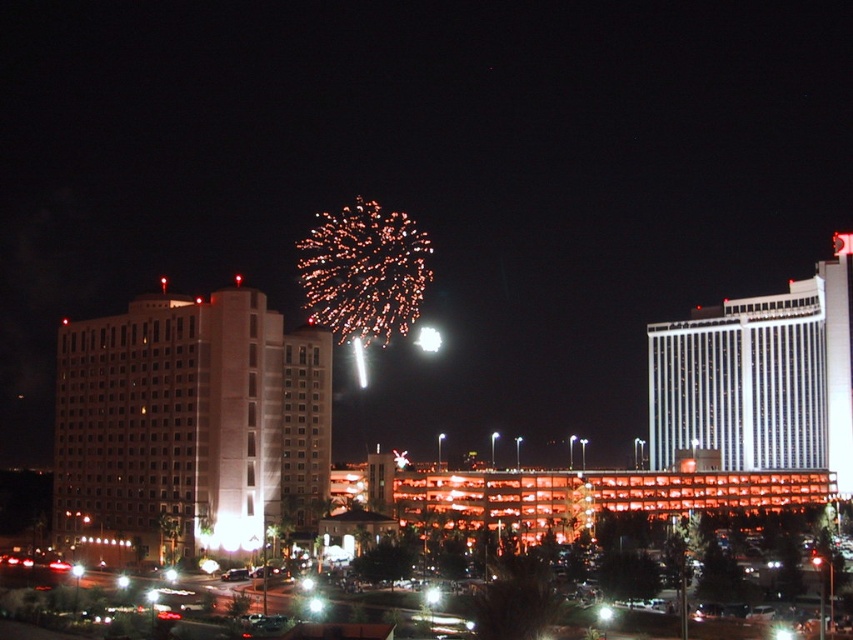
You are a drone operator planning to fly a drone between the matte white building at left and the white glossy building at upper right. The drone has a maximum flight distance of 60 meters. Based on the scene, will the drone be able to fly between them without needing to recharge?

The distance between the matte white building at left and the white glossy building at upper right is 64.73 meters, which exceeds the drone maximum flight distance of 60 meters. The drone will not be able to fly between them without needing to recharge.

You are an architect evaluating the city layout. You notice the matte white building at left and the white glossy building at upper right. Which building has a smaller width according to the scene?

The matte white building at left has a smaller width than the white glossy building at upper right.

You are standing in the parking structure and want to take a photo of both the matte white building at left and the white glossy building at upper right. Which building should you position yourself closer to in order to capture both in the same frame?

You should position yourself closer to the matte white building at left since it is nearer to you compared to the white glossy building at upper right, allowing both to be included in the photo frame more easily.